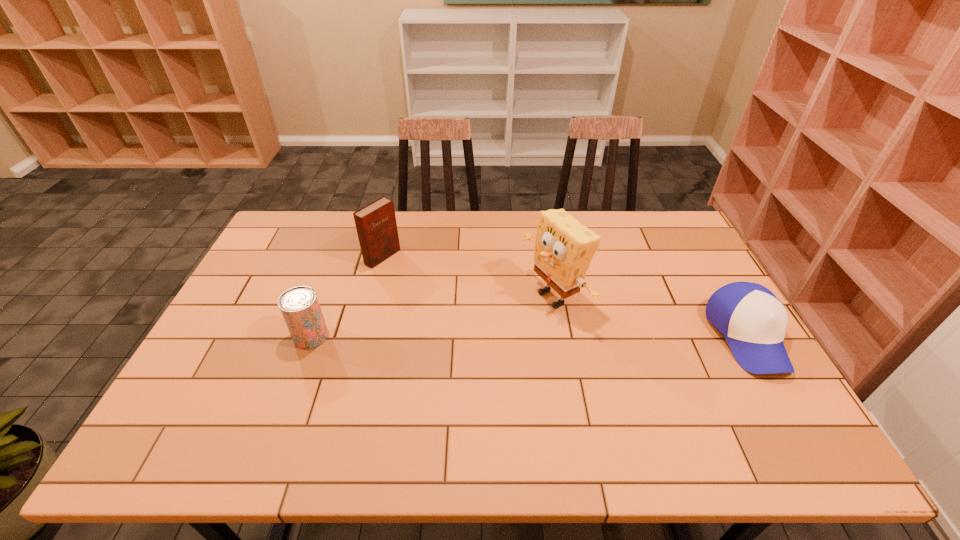
You are a GUI agent. You are given a task and a screenshot of the screen. Output one action in this format:
    pyautogui.click(x=<x>, y=<y>)
    Task: Click on the vacant space located on the front cover of the second object from left to right
    The height and width of the screenshot is (540, 960).
    Given the screenshot: What is the action you would take?
    pyautogui.click(x=411, y=274)

This screenshot has width=960, height=540. I want to click on vacant point located 0.100m on the front cover of the second object from left to right, so click(x=416, y=276).

Find the location of a particular element. Image resolution: width=960 pixels, height=540 pixels. vacant space positioned on the face of the tallest object is located at coordinates (486, 336).

Locate an element on the screen. free region located 0.320m on the face of the tallest object is located at coordinates (430, 362).

Identify the location of vacant space situated on the face of the tallest object. The height and width of the screenshot is (540, 960). (427, 364).

Where is `object that is at the far edge`? object that is at the far edge is located at coordinates (376, 226).

Locate an element on the screen. object situated at the right edge is located at coordinates (753, 320).

Locate an element on the screen. free region at the far edge of the desktop is located at coordinates (470, 216).

What are the coordinates of `vacant space at the near edge of the desktop` in the screenshot? It's located at (607, 415).

The image size is (960, 540). I want to click on vacant space at the left edge of the desktop, so click(x=287, y=256).